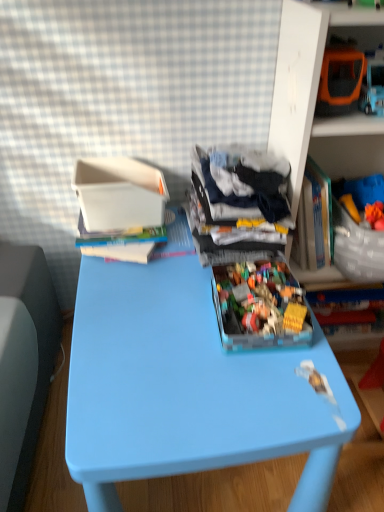
At what (x,y) coordinates should I click in order to perform the action: click on free spot in front of white plastic container at upper left. Please return your answer as a coordinate pair (x, y). This screenshot has height=512, width=384. Looking at the image, I should click on coord(134,283).